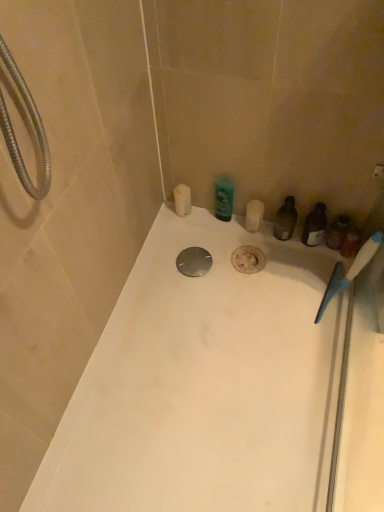
Where is `free space to the left of green glossy bottle at center, acting as the second toiletry starting from the left`? free space to the left of green glossy bottle at center, acting as the second toiletry starting from the left is located at coordinates (181, 232).